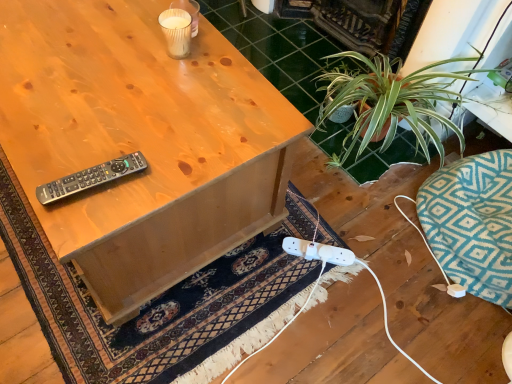
Looking at this image, measure the distance between point (222, 306) and camera.

They are 4.33 feet apart.

At what (x,y) coordinates should I click in order to perform the action: click on matte wood desk at center. Please return your answer as a coordinate pair (x, y). Looking at the image, I should click on (140, 142).

In order to face black plastic remote at upper left, should I rotate leftwards or rightwards?

You should rotate left by 20.251 degrees.

You are a GUI agent. You are given a task and a screenshot of the screen. Output one action in this format:
    pyautogui.click(x=<x>, y=<y>)
    Task: Click on the dark blue woven rug at lower center
    The image size is (512, 384).
    Given the screenshot: What is the action you would take?
    pyautogui.click(x=151, y=300)

Is black plastic remote at upper left not within dark blue woven rug at lower center?

Yes, black plastic remote at upper left is outside of dark blue woven rug at lower center.

In the scene shown: Can you confirm if black plastic remote at upper left is smaller than dark blue woven rug at lower center?

Yes.

Looking at this image, from a real-world perspective, which is physically above, black plastic remote at upper left or dark blue woven rug at lower center?

black plastic remote at upper left is physically above.

Considering the positions of objects black plastic remote at upper left and dark blue woven rug at lower center in the image provided, who is more to the right, black plastic remote at upper left or dark blue woven rug at lower center?

black plastic remote at upper left is more to the right.

Considering the relative sizes of matte wood desk at center and dark blue woven rug at lower center in the image provided, is matte wood desk at center thinner than dark blue woven rug at lower center?

Correct, the width of matte wood desk at center is less than that of dark blue woven rug at lower center.

Between matte wood desk at center and dark blue woven rug at lower center, which one has more height?

Standing taller between the two is matte wood desk at center.

Is matte wood desk at center positioned far away from dark blue woven rug at lower center?

Actually, matte wood desk at center and dark blue woven rug at lower center are a little close together.

From a real-world perspective, which is physically below, matte wood desk at center or dark blue woven rug at lower center?

dark blue woven rug at lower center, from a real-world perspective.

Considering the points (316, 269) and (163, 190), which point is behind, point (316, 269) or point (163, 190)?

Positioned behind is point (316, 269).

Measure the distance between dark blue woven rug at lower center and matte wood desk at center.

dark blue woven rug at lower center and matte wood desk at center are 12.11 inches apart from each other.

From the image's perspective, would you say dark blue woven rug at lower center is shown under matte wood desk at center?

Indeed, from the image's perspective, dark blue woven rug at lower center is shown beneath matte wood desk at center.

Is dark blue woven rug at lower center at the right side of matte wood desk at center?

Indeed, dark blue woven rug at lower center is positioned on the right side of matte wood desk at center.

Does matte wood desk at center have a greater height compared to black plastic remote at upper left?

Correct, matte wood desk at center is much taller as black plastic remote at upper left.

Considering the sizes of matte wood desk at center and black plastic remote at upper left in the image, is matte wood desk at center wider or thinner than black plastic remote at upper left?

Clearly, matte wood desk at center has more width compared to black plastic remote at upper left.

Is matte wood desk at center positioned with its back to black plastic remote at upper left?

matte wood desk at center is not turned away from black plastic remote at upper left.

Does matte wood desk at center contain black plastic remote at upper left?

No, black plastic remote at upper left is not surrounded by matte wood desk at center.

From the image's perspective, is dark blue woven rug at lower center above black plastic remote at upper left?

No, from the image's perspective, dark blue woven rug at lower center is not above black plastic remote at upper left.

At what (x,y) coordinates should I click in order to perform the action: click on doormat that is below the black plastic remote at upper left (from the image's perspective). Please return your answer as a coordinate pair (x, y). This screenshot has height=384, width=512. Looking at the image, I should click on (151, 300).

Is dark blue woven rug at lower center outside of black plastic remote at upper left?

Absolutely, dark blue woven rug at lower center is external to black plastic remote at upper left.

The height and width of the screenshot is (384, 512). Identify the location of remote control above the matte wood desk at center (from a real-world perspective). [91, 177].

Is black plastic remote at upper left positioned in front of matte wood desk at center?

No, black plastic remote at upper left is further to the viewer.

Could you tell me if black plastic remote at upper left is turned towards matte wood desk at center?

No, black plastic remote at upper left is not facing towards matte wood desk at center.

Considering the relative positions of black plastic remote at upper left and matte wood desk at center in the image provided, is black plastic remote at upper left to the right of matte wood desk at center from the viewer's perspective?

Correct, you'll find black plastic remote at upper left to the right of matte wood desk at center.

You are a GUI agent. You are given a task and a screenshot of the screen. Output one action in this format:
    pyautogui.click(x=<x>, y=<y>)
    Task: Click on the remote control lying above the dark blue woven rug at lower center (from the image's perspective)
    The height and width of the screenshot is (384, 512).
    Given the screenshot: What is the action you would take?
    click(x=91, y=177)

Find the location of a particular element. The width and height of the screenshot is (512, 384). doormat behind the matte wood desk at center is located at coordinates (151, 300).

Based on their spatial positions, is black plastic remote at upper left or dark blue woven rug at lower center further from matte wood desk at center?

dark blue woven rug at lower center is positioned further to the anchor matte wood desk at center.

Considering their positions, is black plastic remote at upper left positioned closer to dark blue woven rug at lower center than matte wood desk at center?

matte wood desk at center is closer to dark blue woven rug at lower center.

From the image, which object appears to be nearer to black plastic remote at upper left, matte wood desk at center or dark blue woven rug at lower center?

matte wood desk at center lies closer to black plastic remote at upper left than the other object.

From the picture: When comparing their distances from black plastic remote at upper left, does dark blue woven rug at lower center or matte wood desk at center seem further?

dark blue woven rug at lower center is further to black plastic remote at upper left.

Based on their spatial positions, is matte wood desk at center or black plastic remote at upper left closer to dark blue woven rug at lower center?

Among the two, matte wood desk at center is located nearer to dark blue woven rug at lower center.

Considering their positions, is dark blue woven rug at lower center positioned further to matte wood desk at center than black plastic remote at upper left?

Based on the image, dark blue woven rug at lower center appears to be further to matte wood desk at center.

Where is `remote control positioned between matte wood desk at center and dark blue woven rug at lower center from near to far`? This screenshot has width=512, height=384. remote control positioned between matte wood desk at center and dark blue woven rug at lower center from near to far is located at coordinates [91, 177].